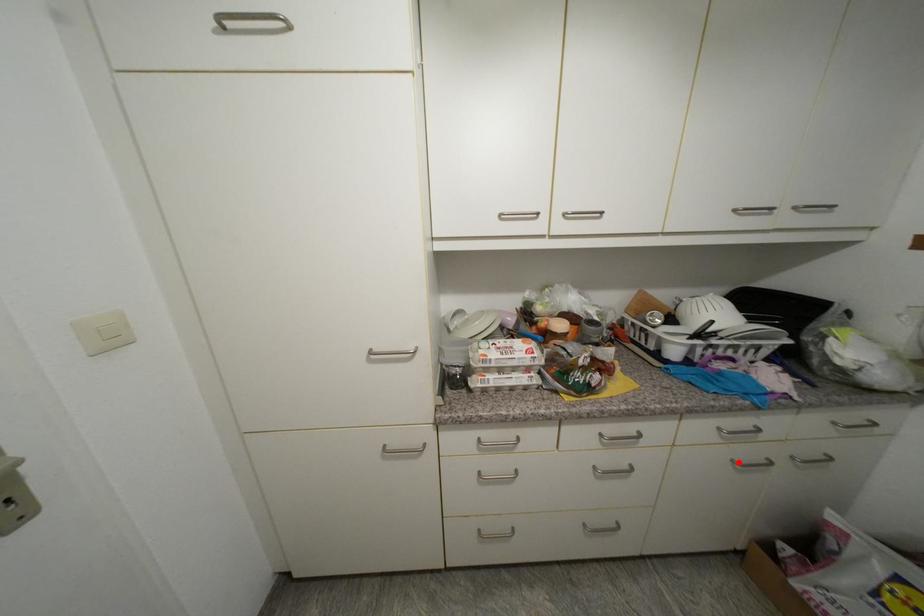
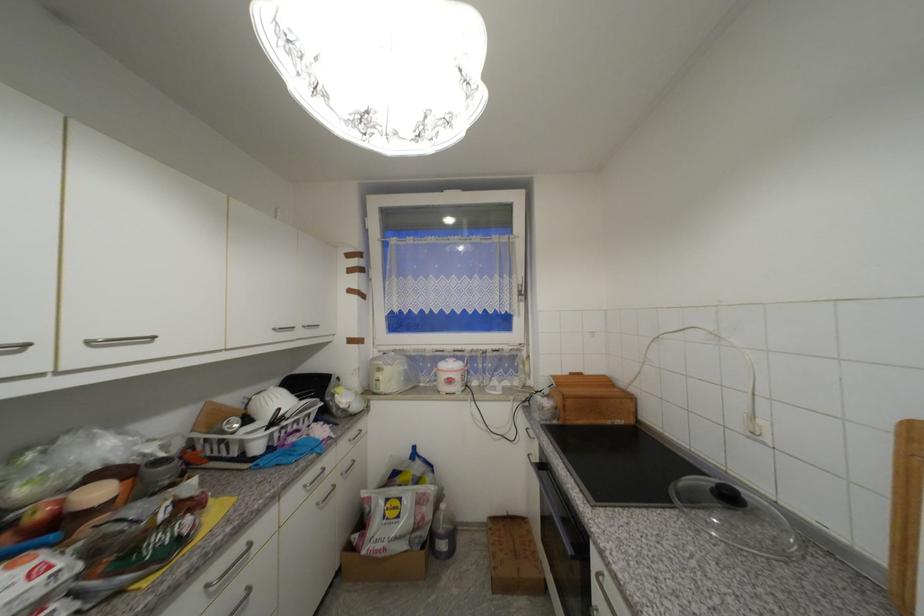
The point at the highlighted location is marked in the first image. Where is the corresponding point in the second image?

(322, 505)